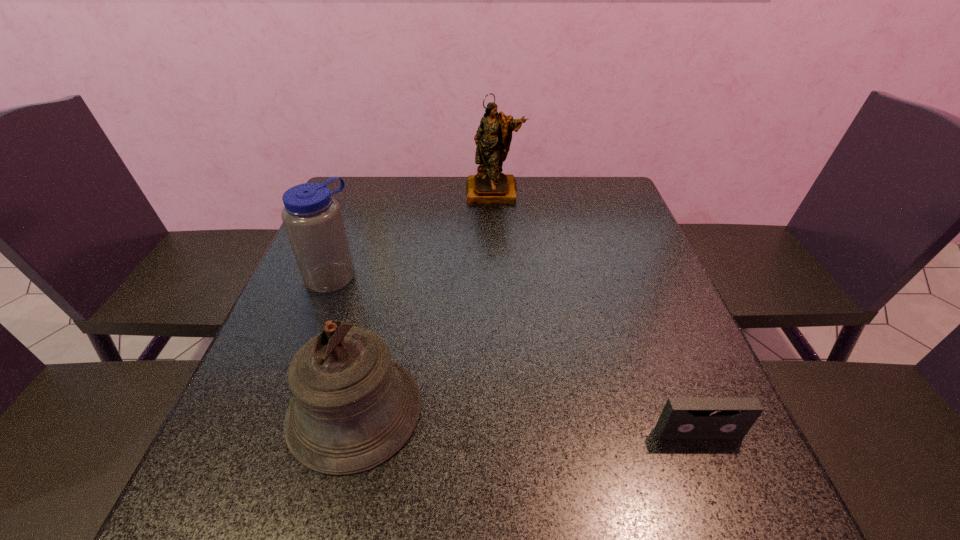
The image size is (960, 540). In order to click on free space that is in between the bell and the shortest object in this screenshot , I will do `click(527, 422)`.

What are the coordinates of `vacant area between the water bottle and the second object from right to left` in the screenshot? It's located at (413, 234).

The image size is (960, 540). I want to click on free area in between the rightmost object and the bell, so click(x=527, y=422).

This screenshot has width=960, height=540. I want to click on object identified as the third closest to the tallest object, so click(682, 417).

I want to click on object that is the third closest to the figurine, so click(682, 417).